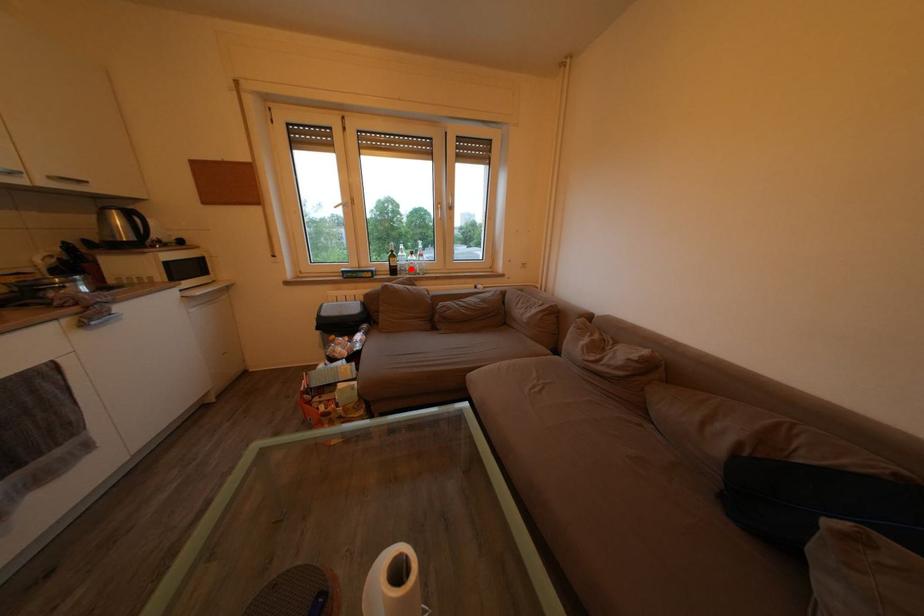
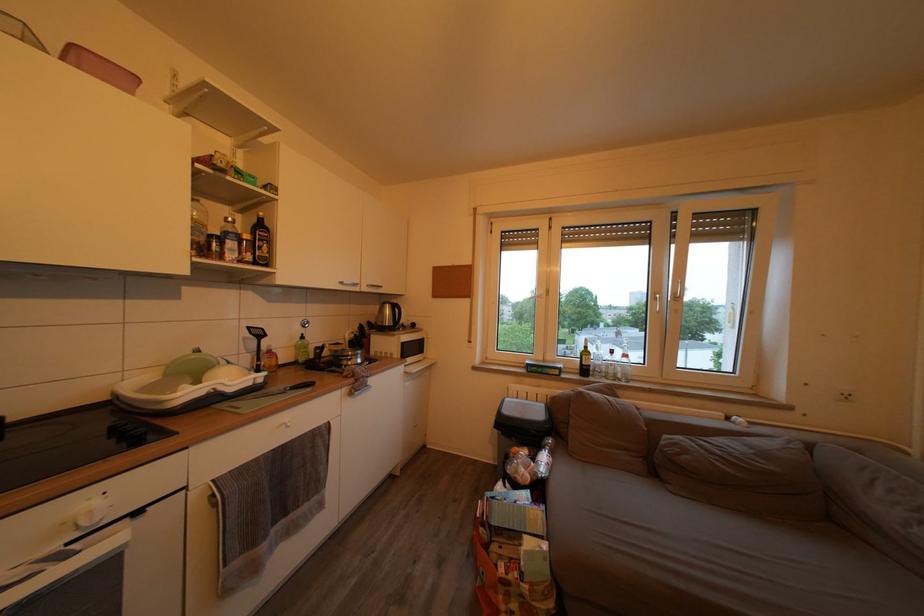
Question: I am providing you with two images of the same scene from different viewpoints. A red point is shown in image1. For the corresponding object point in image2, is it positioned nearer or farther from the camera?

Choices:
 (A) Nearer
 (B) Farther

Answer: (B)